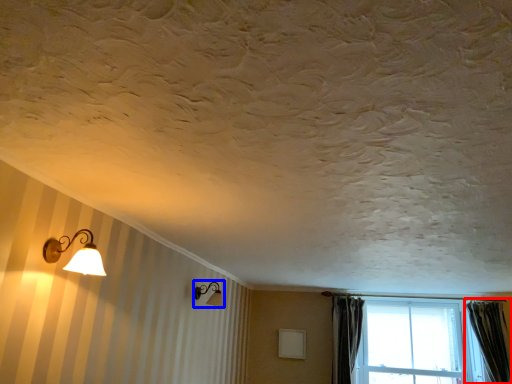
Question: Which point is closer to the camera, curtain (highlighted by a red box) or lamp (highlighted by a blue box)?

Choices:
 (A) curtain
 (B) lamp

Answer: (B)